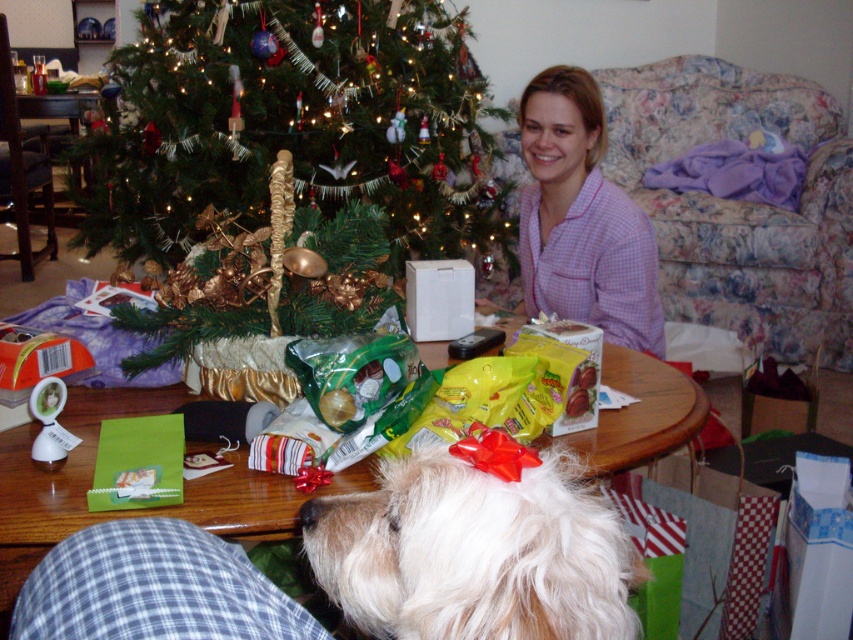
Question: Does white fluffy dog at center lie in front of wooden table at center?

Choices:
 (A) yes
 (B) no

Answer: (A)

Question: Which object appears farthest from the camera in this image?

Choices:
 (A) white fluffy dog at center
 (B) pink checkered pajamas at center
 (C) green matte christmas tree at upper left

Answer: (C)

Question: Which point appears farthest from the camera in this image?

Choices:
 (A) (0, 433)
 (B) (538, 140)
 (C) (392, 592)
 (D) (467, 76)

Answer: (D)

Question: Is wooden table at center smaller than pink checkered pajamas at center?

Choices:
 (A) no
 (B) yes

Answer: (B)

Question: Which of these objects is positioned farthest from the white fluffy dog at center?

Choices:
 (A) green matte christmas tree at upper left
 (B) wooden table at center
 (C) pink checkered pajamas at center

Answer: (A)

Question: Can you confirm if green matte christmas tree at upper left is thinner than white fluffy dog at center?

Choices:
 (A) no
 (B) yes

Answer: (A)